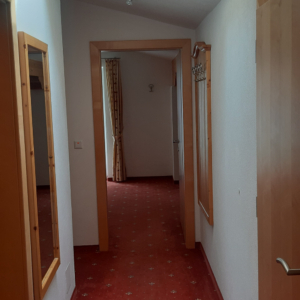
The image size is (300, 300). In order to click on trim in this screenshot , I will do `click(108, 198)`, `click(191, 181)`, `click(149, 47)`.